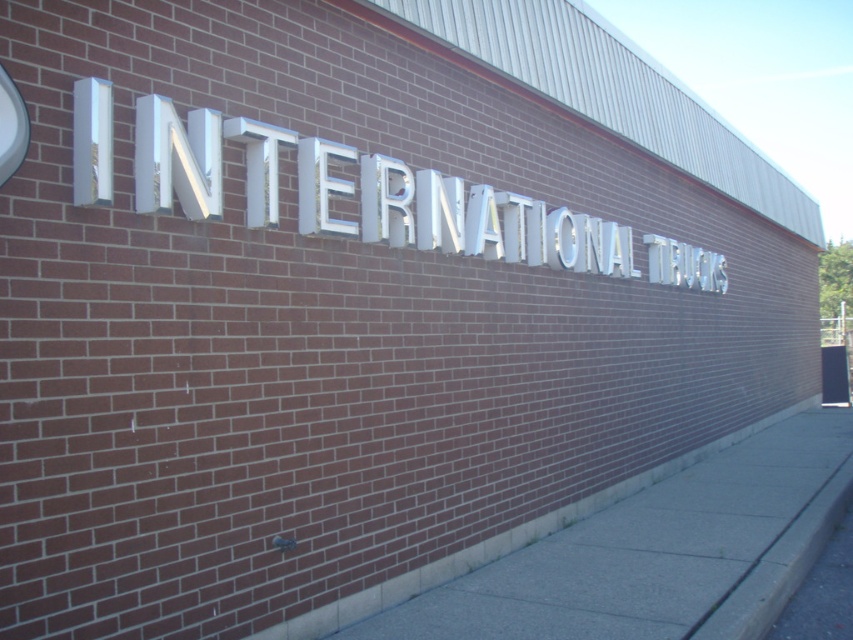
You are a delivery driver who needs to park your truck near the white metallic sign at center without blocking the gray concrete sidewalk at lower center. The truck requires a minimum of 5 meters of clearance to safely maneuver. Based on the scene, can you park your truck in this location?

The gray concrete sidewalk at lower center is 4.96 meters away from the white metallic sign at center. Since the truck requires 5 meters of clearance to safely maneuver, the available space is insufficient. Therefore, parking here would not be safe.

You are a delivery person trying to park your van near the entrance. The van requires a space wider than the gray concrete sidewalk at lower center. Can you park your van in the space where the white metallic sign at center is located?

The gray concrete sidewalk at lower center is wider than the white metallic sign at center. Since the van requires a space wider than the sidewalk, the space at the sign is narrower and thus insufficient for parking.